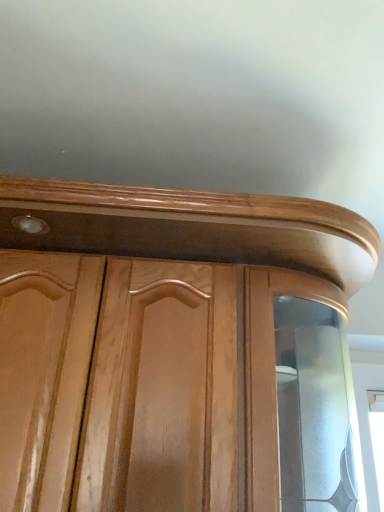
The width and height of the screenshot is (384, 512). Describe the element at coordinates (175, 349) in the screenshot. I see `glossy wood cupboard at center` at that location.

Find the location of a particular element. glossy wood cupboard at center is located at coordinates (175, 349).

Find the location of a particular element. The width and height of the screenshot is (384, 512). glossy wood cupboard at center is located at coordinates (175, 349).